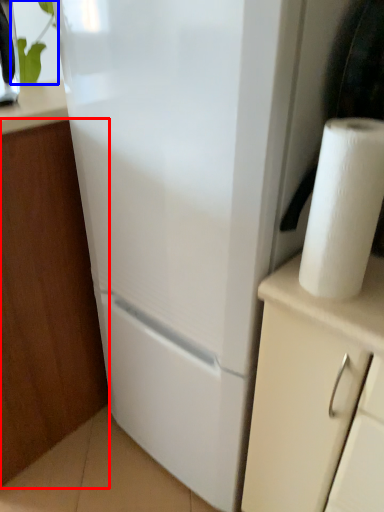
Question: Which point is closer to the camera, cabinetry (highlighted by a red box) or plant (highlighted by a blue box)?

Choices:
 (A) cabinetry
 (B) plant

Answer: (A)